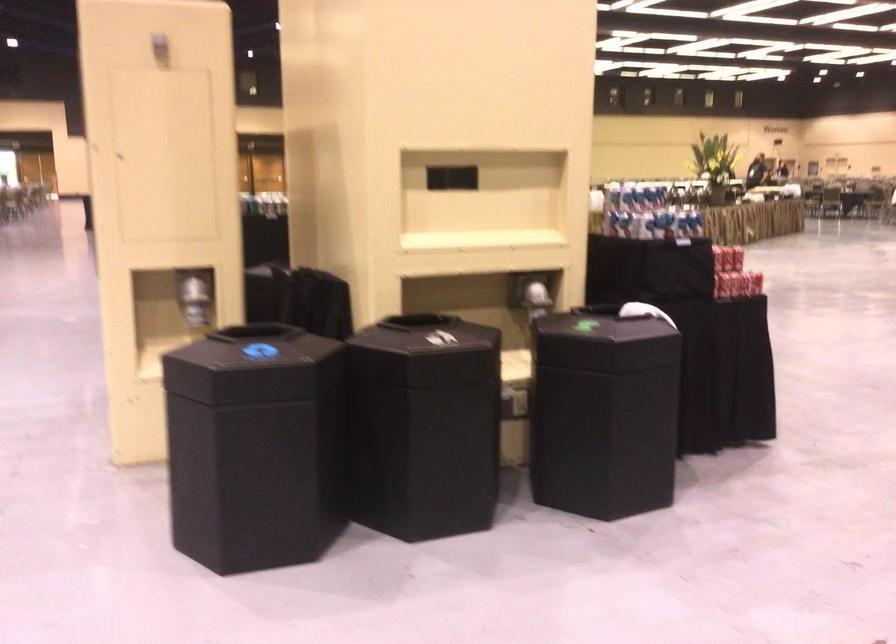
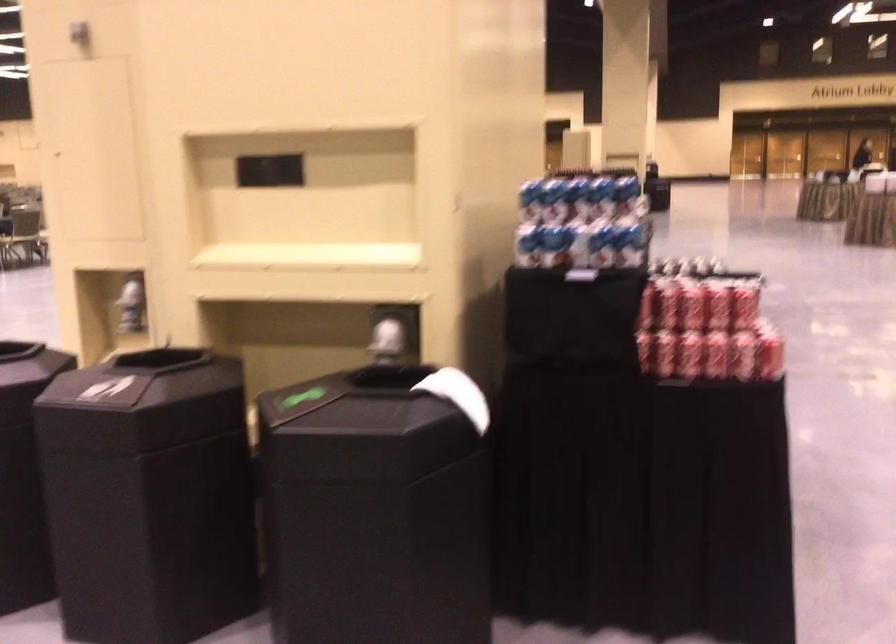
The point at [726,281] is marked in the first image. Where is the corresponding point in the second image?

(645, 351)